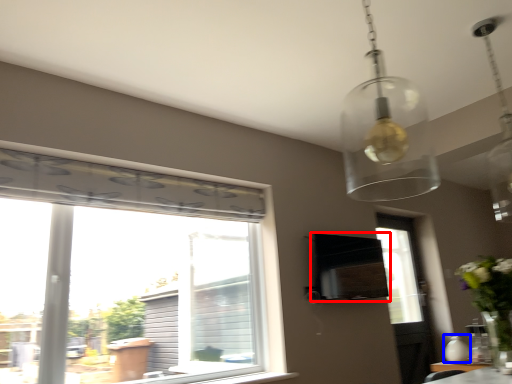
Question: Which object appears closest to the camera in this image, vent (highlighted by a red box) or vase (highlighted by a blue box)?

Choices:
 (A) vent
 (B) vase

Answer: (B)